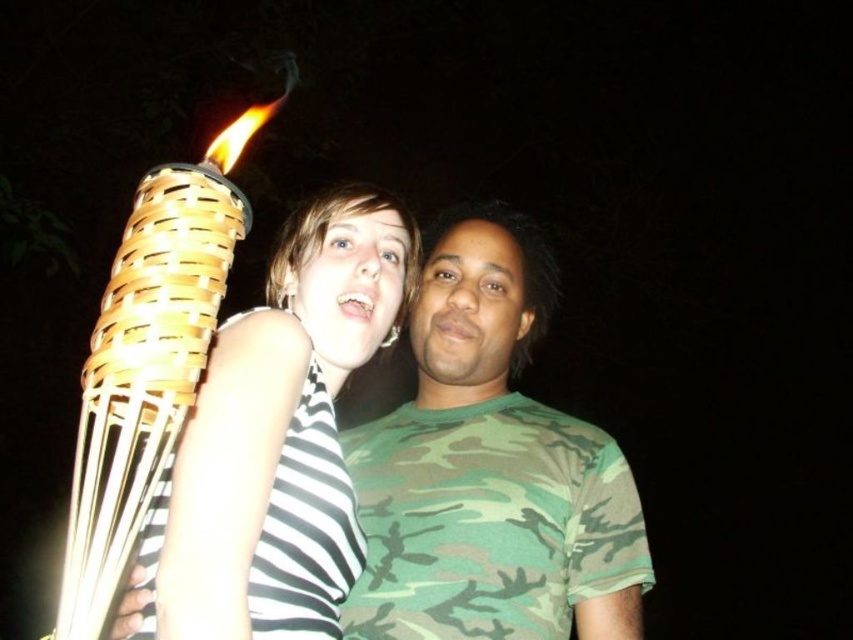
Question: Is camouflage fabric shirt at center positioned at the back of woven bamboo torch at left?

Choices:
 (A) yes
 (B) no

Answer: (A)

Question: Can you confirm if matte woven torch at left is positioned to the left of woven bamboo torch at left?

Choices:
 (A) yes
 (B) no

Answer: (B)

Question: Estimate the real-world distances between objects in this image. Which object is closer to the woven bamboo torch at left?

Choices:
 (A) matte woven torch at left
 (B) camouflage fabric shirt at center

Answer: (A)

Question: Which point is closer to the camera?

Choices:
 (A) (546, 442)
 (B) (154, 422)
 (C) (289, 492)

Answer: (B)

Question: Can you confirm if camouflage fabric shirt at center is smaller than woven bamboo torch at left?

Choices:
 (A) no
 (B) yes

Answer: (A)

Question: Among these objects, which one is nearest to the camera?

Choices:
 (A) camouflage fabric shirt at center
 (B) woven bamboo torch at left

Answer: (B)